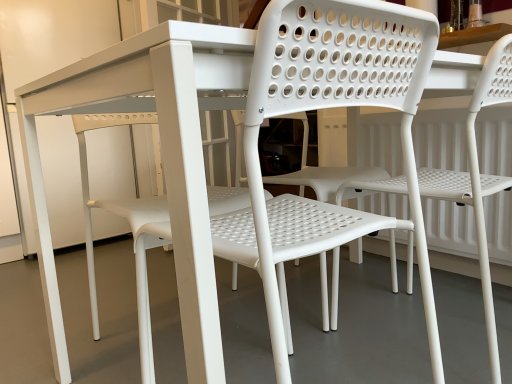
Question: Considering the relative sizes of white plastic chair at center, the second chair from the left, and white plastic chair at center in the image provided, is white plastic chair at center, the second chair from the left, taller than white plastic chair at center?

Choices:
 (A) yes
 (B) no

Answer: (A)

Question: From the image's perspective, is white plastic chair at center, the second chair from the left, on top of white plastic chair at center?

Choices:
 (A) yes
 (B) no

Answer: (A)

Question: From a real-world perspective, is white plastic chair at center, the 1th chair positioned from the right, located beneath white plastic chair at center?

Choices:
 (A) no
 (B) yes

Answer: (A)

Question: From the image's perspective, is white plastic chair at center, the second chair from the left, below white plastic chair at center?

Choices:
 (A) yes
 (B) no

Answer: (B)

Question: Is white plastic chair at center, the second chair from the left, outside white plastic chair at center?

Choices:
 (A) yes
 (B) no

Answer: (A)

Question: From a real-world perspective, is white plastic chair at center physically located above or below white plastic chair at center, the 1th chair positioned from the right?

Choices:
 (A) above
 (B) below

Answer: (B)

Question: Is point (279, 299) positioned closer to the camera than point (493, 104)?

Choices:
 (A) farther
 (B) closer

Answer: (B)

Question: From the image's perspective, relative to white plastic chair at center, the second chair from the left, is white plastic chair at center above or below?

Choices:
 (A) below
 (B) above

Answer: (A)

Question: Considering the positions of white plastic chair at center and white plastic chair at center, the 1th chair positioned from the right, in the image, is white plastic chair at center wider or thinner than white plastic chair at center, the 1th chair positioned from the right,?

Choices:
 (A) thin
 (B) wide

Answer: (B)

Question: Is white plastic chair at center taller or shorter than white plastic chair at center, which is counted as the second chair, starting from the right?

Choices:
 (A) short
 (B) tall

Answer: (A)

Question: Is white plastic chair at center spatially inside white plastic chair at center, which is counted as the second chair, starting from the right, or outside of it?

Choices:
 (A) inside
 (B) outside

Answer: (B)

Question: Does point (231, 244) appear closer or farther from the camera than point (251, 163)?

Choices:
 (A) closer
 (B) farther

Answer: (B)

Question: Visually, is white plastic chair at center positioned to the left or to the right of white plastic chair at center, the 1th chair when ordered from left to right?

Choices:
 (A) left
 (B) right

Answer: (A)

Question: In terms of size, does white plastic chair at center, the second chair from the left, appear bigger or smaller than white plastic chair at center?

Choices:
 (A) small
 (B) big

Answer: (A)

Question: Relative to white plastic chair at center, is white plastic chair at center, the 1th chair positioned from the right, in front or behind?

Choices:
 (A) behind
 (B) front

Answer: (A)